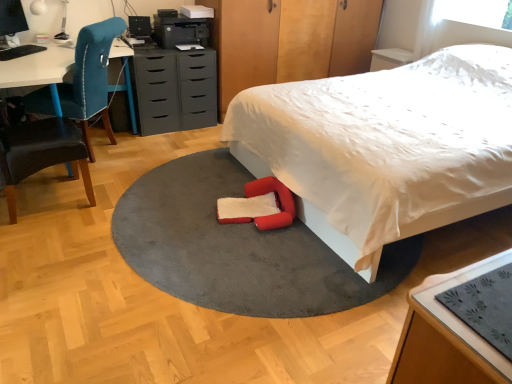
This screenshot has width=512, height=384. I want to click on free location to the left of red plush bean bag chair at lower center, so click(181, 212).